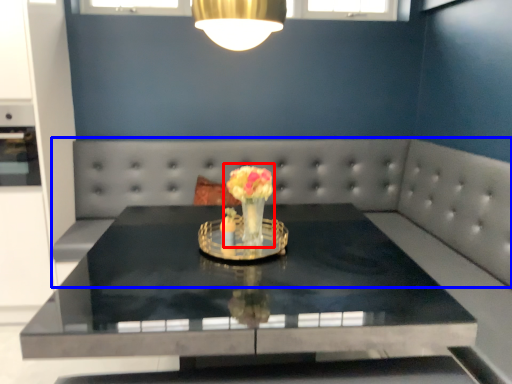
Question: Which of the following is the farthest to the observer, floral arrangement (highlighted by a red box) or couch (highlighted by a blue box)?

Choices:
 (A) floral arrangement
 (B) couch

Answer: (B)